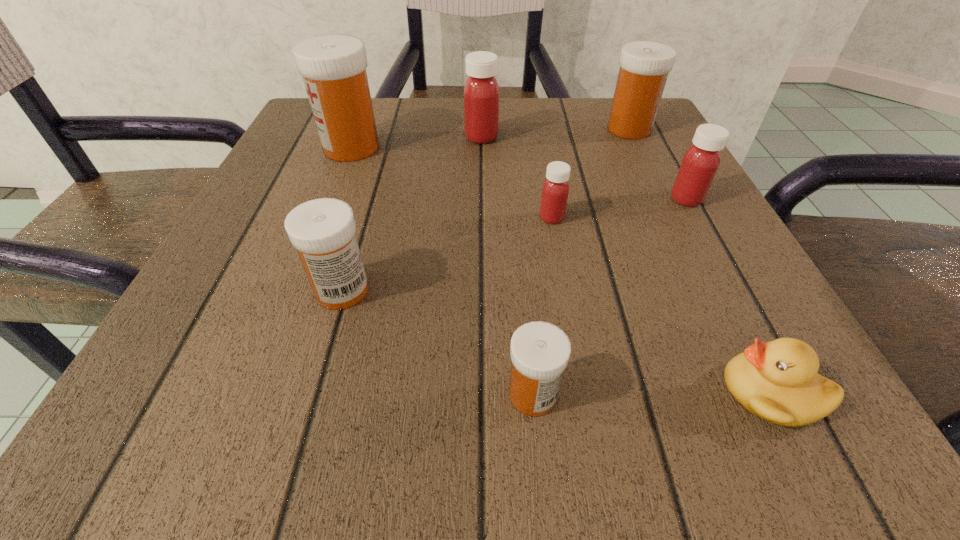
Locate an element on the screen. free space between the second biggest red medicine and the nearest white medicine is located at coordinates (610, 297).

What are the coordinates of `vacant space that's between the biggest red medicine and the second red medicine from left to right` in the screenshot? It's located at (516, 178).

Find the location of a particular element. Image resolution: width=960 pixels, height=540 pixels. free spot between the sixth farthest medicine and the smallest white medicine is located at coordinates (438, 342).

This screenshot has height=540, width=960. I want to click on empty space between the third biggest white medicine and the leftmost red medicine, so click(x=412, y=214).

Image resolution: width=960 pixels, height=540 pixels. Find the location of `vacant area between the biggest red medicine and the second nearest red medicine`. vacant area between the biggest red medicine and the second nearest red medicine is located at coordinates (584, 168).

Where is `the third closest object to the second farthest red medicine`? The width and height of the screenshot is (960, 540). the third closest object to the second farthest red medicine is located at coordinates (777, 381).

Identify which object is the fourth closest to the rightmost white medicine. Please provide its 2D coordinates. Your answer should be formatted as a tuple, i.e. [(x, y)], where the tuple contains the x and y coordinates of a point satisfying the conditions above.

[(333, 67)]

Choose which medicine is the fifth nearest neighbor to the smallest white medicine. Please provide its 2D coordinates. Your answer should be formatted as a tuple, i.e. [(x, y)], where the tuple contains the x and y coordinates of a point satisfying the conditions above.

[(481, 91)]

Locate which medicine ranks sixth in proximity to the second red medicine from right to left. Please provide its 2D coordinates. Your answer should be formatted as a tuple, i.e. [(x, y)], where the tuple contains the x and y coordinates of a point satisfying the conditions above.

[(333, 67)]

Image resolution: width=960 pixels, height=540 pixels. What are the coordinates of `the closest white medicine to the nearest white medicine` in the screenshot? It's located at (323, 231).